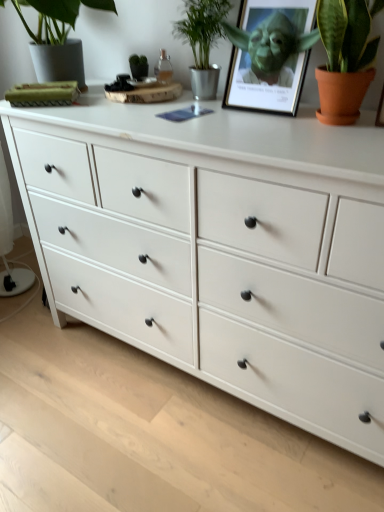
Identify the location of free space on the front side of matte green picture frame at upper center. point(280,129).